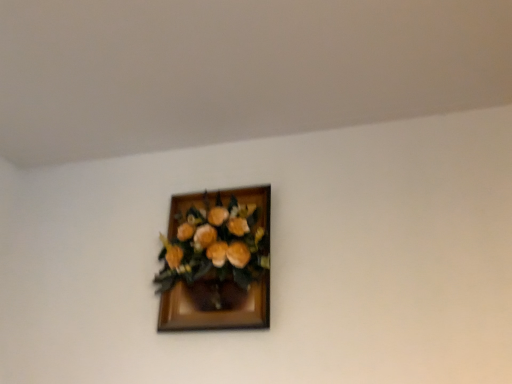
Locate an element on the screen. This screenshot has width=512, height=384. wooden picture frame at upper center is located at coordinates click(x=216, y=261).

Describe the element at coordinates (216, 261) in the screenshot. I see `wooden picture frame at upper center` at that location.

This screenshot has width=512, height=384. In order to click on wooden picture frame at upper center in this screenshot , I will do `click(216, 261)`.